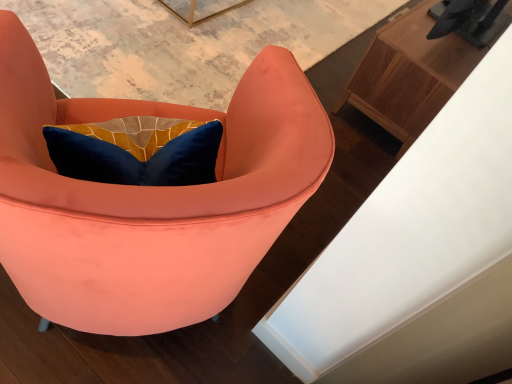
Question: Should I look upward or downward to see wooden cabinet at upper right?

Choices:
 (A) down
 (B) up

Answer: (B)

Question: Is wooden cabinet at upper right at the left side of matte coral armchair at center?

Choices:
 (A) yes
 (B) no

Answer: (B)

Question: From a real-world perspective, does wooden cabinet at upper right sit lower than matte coral armchair at center?

Choices:
 (A) no
 (B) yes

Answer: (B)

Question: Is wooden cabinet at upper right positioned far away from matte coral armchair at center?

Choices:
 (A) no
 (B) yes

Answer: (B)

Question: From the image's perspective, is wooden cabinet at upper right above matte coral armchair at center?

Choices:
 (A) no
 (B) yes

Answer: (B)

Question: Is wooden cabinet at upper right wider than matte coral armchair at center?

Choices:
 (A) no
 (B) yes

Answer: (A)

Question: Can you confirm if wooden cabinet at upper right is smaller than matte coral armchair at center?

Choices:
 (A) no
 (B) yes

Answer: (B)

Question: Considering the relative sizes of matte coral armchair at center and wooden cabinet at upper right in the image provided, is matte coral armchair at center thinner than wooden cabinet at upper right?

Choices:
 (A) no
 (B) yes

Answer: (A)

Question: Is matte coral armchair at center shorter than wooden cabinet at upper right?

Choices:
 (A) yes
 (B) no

Answer: (B)

Question: Are matte coral armchair at center and wooden cabinet at upper right making contact?

Choices:
 (A) yes
 (B) no

Answer: (B)

Question: Is matte coral armchair at center closer to the viewer compared to wooden cabinet at upper right?

Choices:
 (A) no
 (B) yes

Answer: (B)

Question: Is wooden cabinet at upper right located within matte coral armchair at center?

Choices:
 (A) yes
 (B) no

Answer: (B)

Question: Is matte coral armchair at center located outside wooden cabinet at upper right?

Choices:
 (A) no
 (B) yes

Answer: (B)

Question: Is matte coral armchair at center bigger or smaller than wooden cabinet at upper right?

Choices:
 (A) big
 (B) small

Answer: (A)